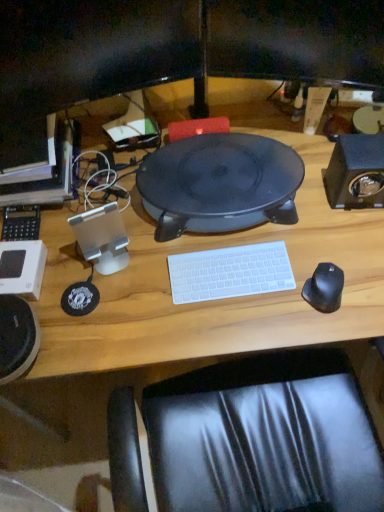
Question: From a real-world perspective, is wooden desk at center above or below black matte mouse at right?

Choices:
 (A) above
 (B) below

Answer: (B)

Question: Is wooden desk at center inside the boundaries of black matte mouse at right, or outside?

Choices:
 (A) outside
 (B) inside

Answer: (A)

Question: Which of these objects is positioned farthest from the black matte mouse at right?

Choices:
 (A) white plastic keyboard at center
 (B) wooden desk at center
 (C) black matte speaker at right
 (D) matte black monitor at left
 (E) black matte speaker at center

Answer: (D)

Question: Which object is the farthest from the white plastic keyboard at center?

Choices:
 (A) black matte speaker at right
 (B) black matte mouse at right
 (C) black matte speaker at center
 (D) wooden desk at center
 (E) matte black monitor at left

Answer: (E)